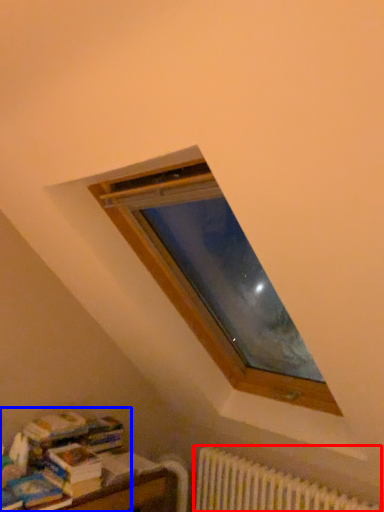
Question: Which object appears closest to the camera in this image, radiator (highlighted by a red box) or book (highlighted by a blue box)?

Choices:
 (A) radiator
 (B) book

Answer: (A)